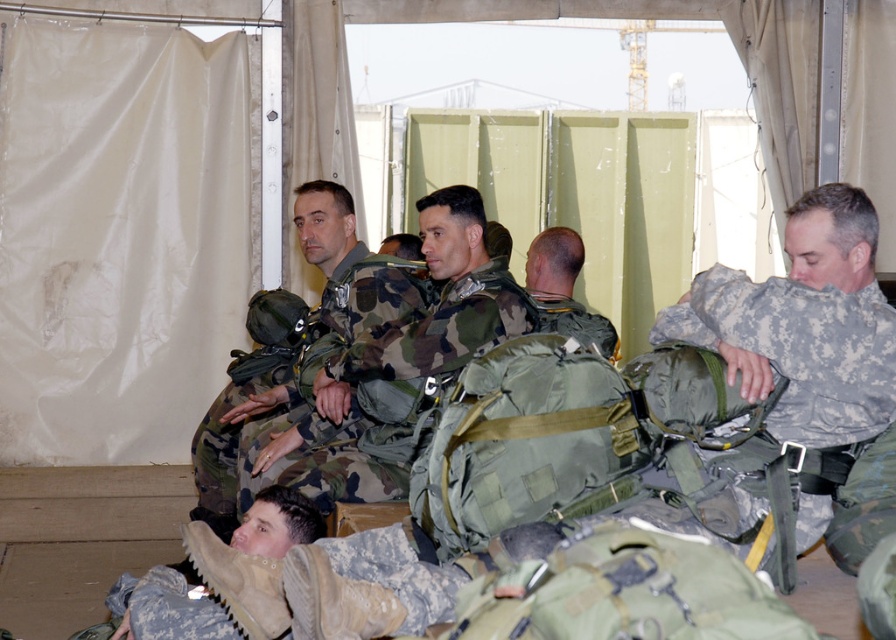
Which is behind, point (434, 216) or point (371, 458)?

Positioned behind is point (434, 216).

Does camouflage uniform at center lie in front of camouflage fabric uniform at center?

Yes, camouflage uniform at center is in front of camouflage fabric uniform at center.

Which is in front, point (336, 372) or point (210, 476)?

Point (336, 372) is more forward.

The width and height of the screenshot is (896, 640). Find the location of `camouflage uniform at center`. camouflage uniform at center is located at coordinates (405, 358).

Can you confirm if green camouflage backpack at center is bigger than camouflage fabric backpack at center?

Yes, green camouflage backpack at center is bigger than camouflage fabric backpack at center.

Between point (563, 285) and point (535, 291), which one is positioned in front?

Point (535, 291) is more forward.

This screenshot has width=896, height=640. What do you see at coordinates (563, 289) in the screenshot?
I see `green camouflage backpack at center` at bounding box center [563, 289].

This screenshot has height=640, width=896. What are the coordinates of `green camouflage backpack at center` in the screenshot? It's located at click(563, 289).

Between camouflage uniform at center and green camouflage backpack at center, which one has more height?

With more height is camouflage uniform at center.

Who is lower down, camouflage uniform at center or green camouflage backpack at center?

camouflage uniform at center is lower down.

Is point (449, 230) farther from camera compared to point (580, 330)?

That is False.

Where is `camouflage uniform at center`? camouflage uniform at center is located at coordinates (405, 358).